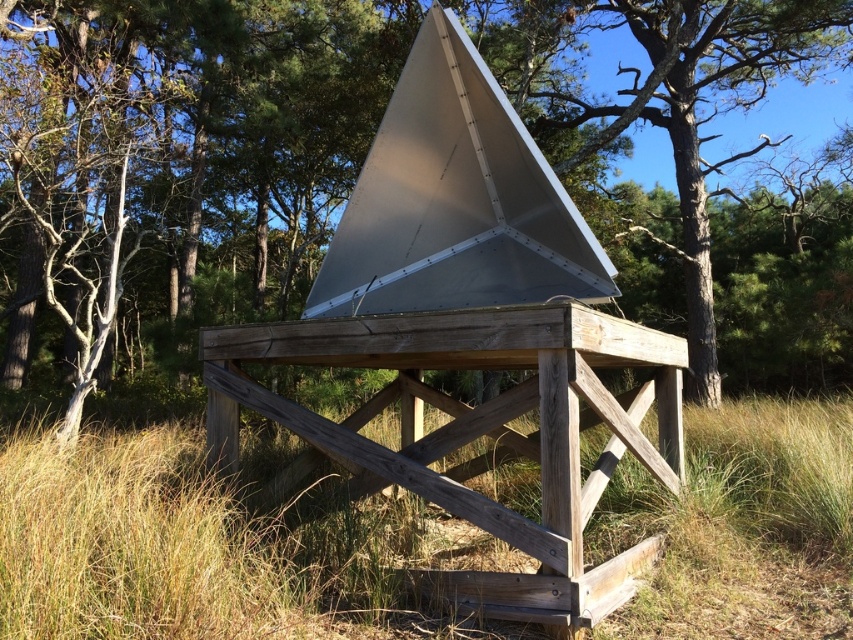
You are planning a picnic and see the brown grass at lower center and the wooden picnic table at center. Which area would be better for spreading a large blanket? Explain your choice based on their sizes.

The wooden picnic table at center occupies more space than the brown grass at lower center, so the wooden picnic table at center is better for spreading a large blanket.

Consider the image. You are standing at the edge of the scene and want to place a small garden ornament between the matte silver pyramid at center and the brown grass at lower center. Based on their positions, which direction should you move from the grass to position the ornament correctly?

You should move to the right from the brown grass at lower center because the matte silver pyramid at center is located to the right of it.